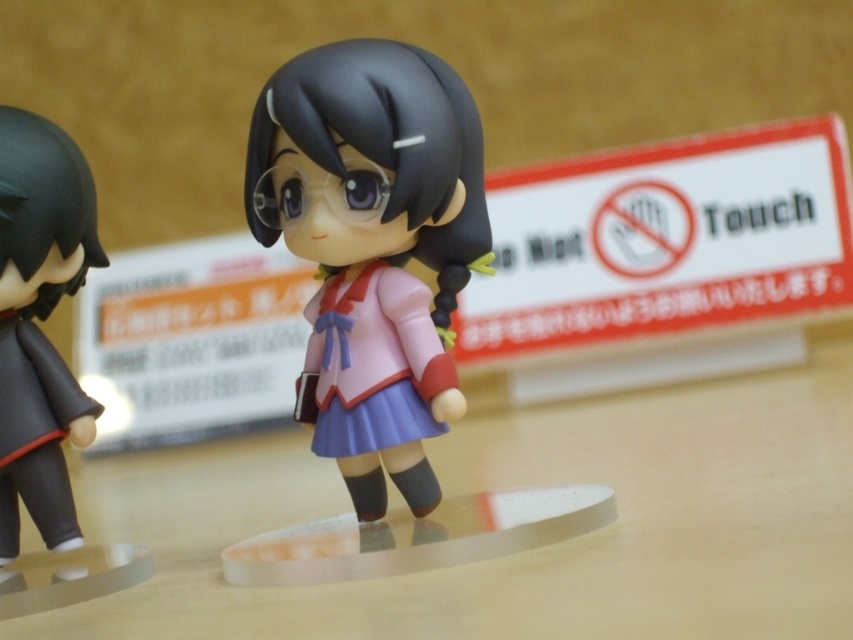
What do you see at coordinates (374, 244) in the screenshot? The image size is (853, 640). I see `matte plastic doll at center` at bounding box center [374, 244].

Who is more forward, (432, 312) or (91, 435)?

Positioned in front is point (432, 312).

This screenshot has height=640, width=853. Identify the location of matte plastic doll at center. (374, 244).